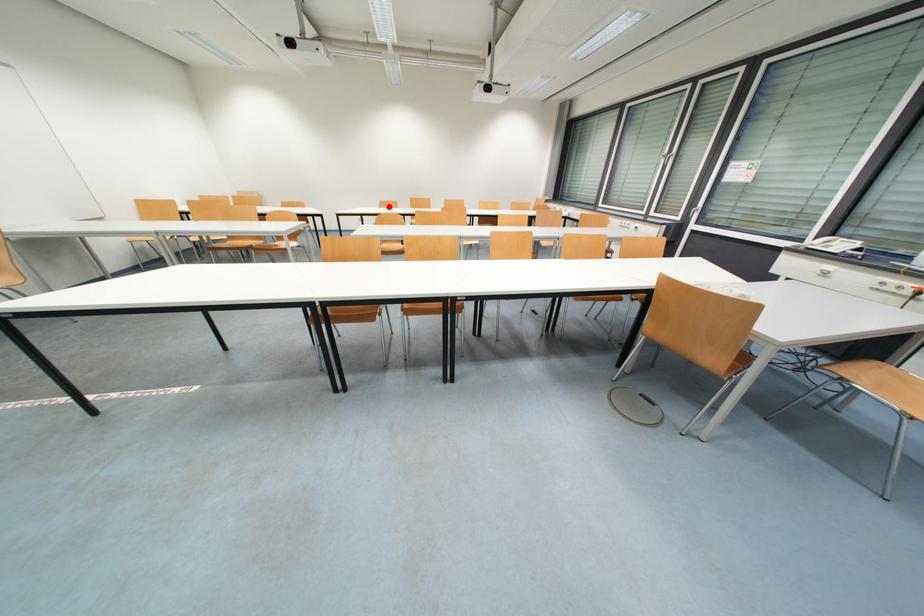
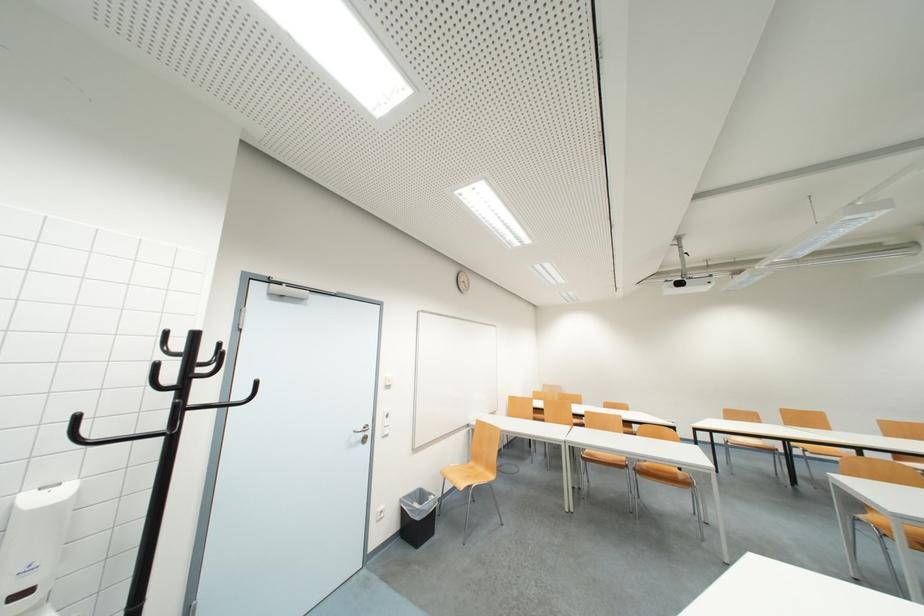
Question: I am providing you with two images of the same scene from different viewpoints. In image1, a red point is highlighted. Considering the same 3D point in image2, which of the following is correct?

Choices:
 (A) It is closer
 (B) It is farther

Answer: (B)